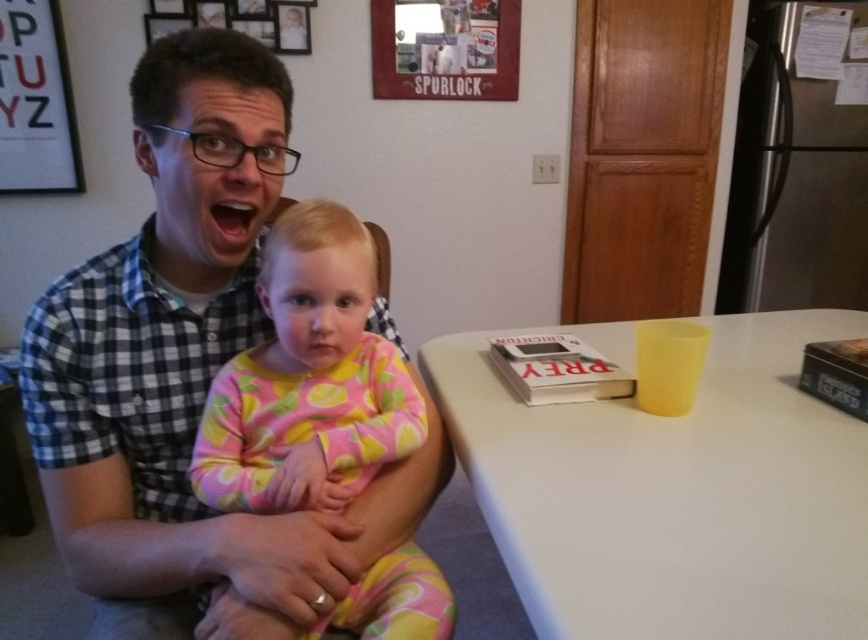
You are standing in the kitchen and want to place a small plate on the white matte table at center. The checkered fabric shirt at upper left is in your way. Can you move around it to reach the table?

The checkered fabric shirt at upper left is further to the viewer than the white matte table at center, so you can move around it to reach the table.

You are standing in the kitchen scene and need to locate the checkered fabric shirt at upper left. Based on the coordinates provided, where exactly would you find it?

The checkered fabric shirt at upper left is located at point (188,376).